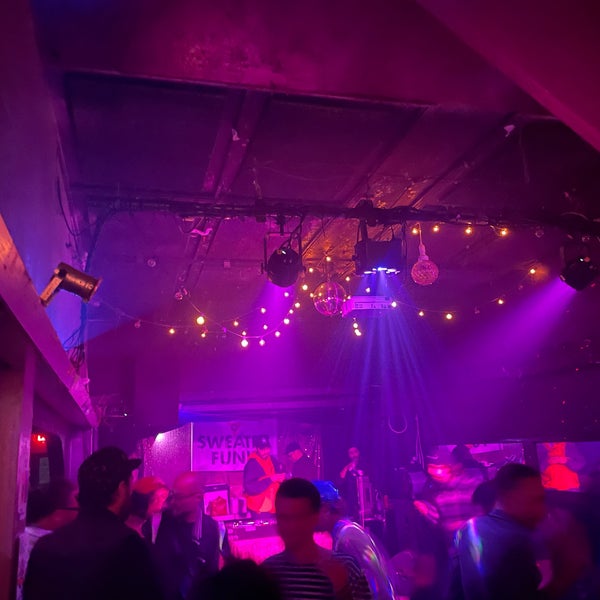
Locate an element on the screen. Image resolution: width=600 pixels, height=600 pixels. string lights is located at coordinates (232, 332), (257, 308), (449, 310), (468, 230).